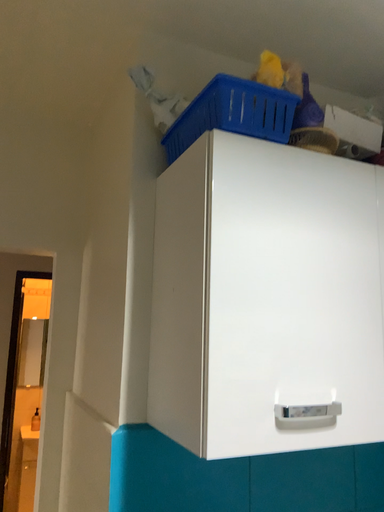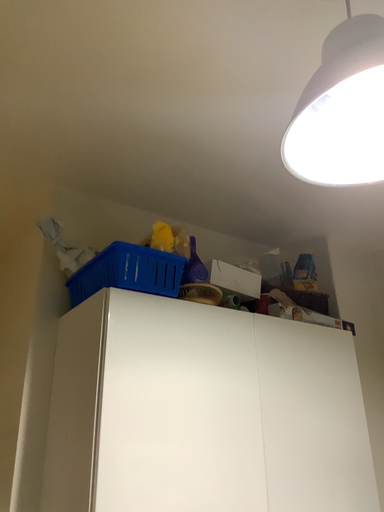
Question: Which way did the camera rotate in the video?

Choices:
 (A) rotated downward
 (B) rotated upward

Answer: (B)